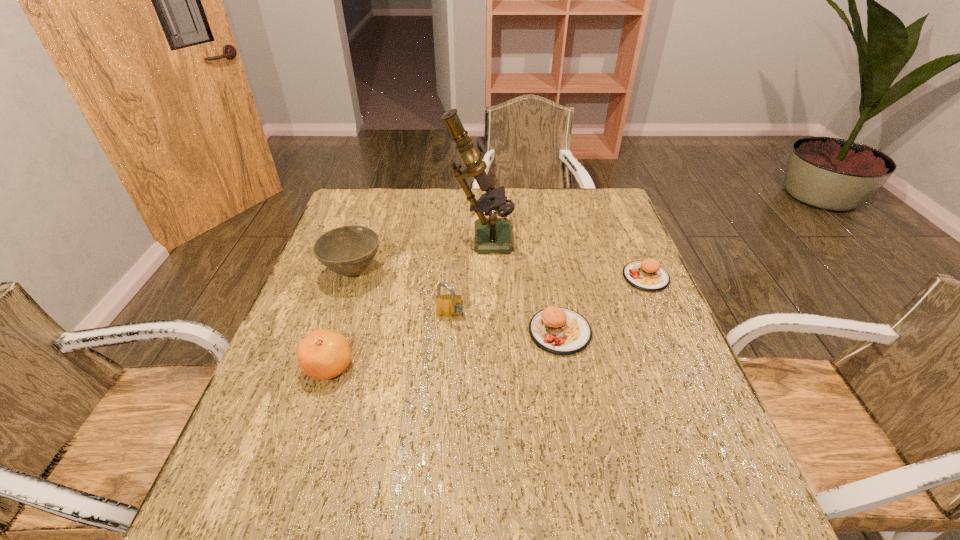
Please point out where to position a new patty on the left to maintain spacing. Please provide its 2D coordinates. Your answer should be formatted as a tuple, i.e. [(x, y)], where the tuple contains the x and y coordinates of a point satisfying the conditions above.

[(445, 404)]